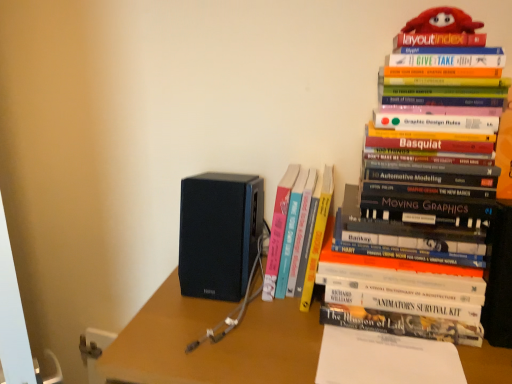
I want to click on space that is in front of hardcover book at center, which is the second book in right-to-left order, so click(270, 329).